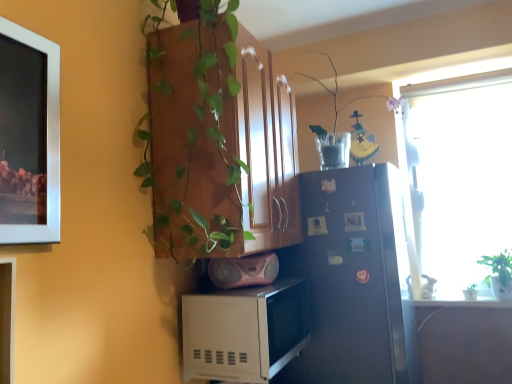
Identify the location of pink matte speaker at center. (244, 270).

Considering the relative sizes of white matte microwave at lower center and satin black refrigerator at right in the image provided, is white matte microwave at lower center smaller than satin black refrigerator at right?

Yes, white matte microwave at lower center is smaller than satin black refrigerator at right.

Would you say white matte microwave at lower center is inside or outside satin black refrigerator at right?

white matte microwave at lower center exists outside the volume of satin black refrigerator at right.

Considering the sizes of objects white matte microwave at lower center and satin black refrigerator at right in the image provided, who is wider, white matte microwave at lower center or satin black refrigerator at right?

satin black refrigerator at right.

Is the depth of white matte microwave at lower center greater than that of satin black refrigerator at right?

No.

Would you consider clear glass vase at upper right to be distant from pink matte speaker at center?

clear glass vase at upper right is far away from pink matte speaker at center.

At what (x,y) coordinates should I click in order to perform the action: click on appliance that appears below the clear glass vase at upper right (from the image's perspective). Please return your answer as a coordinate pair (x, y). Looking at the image, I should click on (244, 270).

Considering the relative sizes of clear glass vase at upper right and pink matte speaker at center in the image provided, is clear glass vase at upper right smaller than pink matte speaker at center?

Incorrect, clear glass vase at upper right is not smaller in size than pink matte speaker at center.

From the image's perspective, is clear glass vase at upper right located above pink matte speaker at center?

Yes.

Can you confirm if clear glass vase at upper right is shorter than satin black refrigerator at right?

Yes, clear glass vase at upper right is shorter than satin black refrigerator at right.

From the image's perspective, is clear glass vase at upper right on satin black refrigerator at right?

Indeed, from the image's perspective, clear glass vase at upper right is shown above satin black refrigerator at right.

Based on the photo, from a real-world perspective, is clear glass vase at upper right above or below satin black refrigerator at right?

clear glass vase at upper right is situated higher than satin black refrigerator at right in the real world.

Is pink matte speaker at center at the back of satin black refrigerator at right?

satin black refrigerator at right is not turned away from pink matte speaker at center.

In order to click on appliance above the satin black refrigerator at right (from a real-world perspective) in this screenshot , I will do tap(244, 270).

Which point is more forward, (396, 173) or (229, 278)?

Positioned in front is point (229, 278).

From the image's perspective, which one is positioned lower, satin black refrigerator at right or pink matte speaker at center?

satin black refrigerator at right.

From the picture: Which is closer to the camera, (243, 366) or (261, 276)?

Point (243, 366) is closer to the camera than point (261, 276).

Is white matte microwave at lower center oriented away from pink matte speaker at center?

That's not correct — white matte microwave at lower center is not looking away from pink matte speaker at center.

Is white matte microwave at lower center not inside pink matte speaker at center?

Yes, white matte microwave at lower center is outside of pink matte speaker at center.

Based on the photo, is white matte microwave at lower center far away from pink matte speaker at center?

white matte microwave at lower center is actually quite close to pink matte speaker at center.

Can you tell me how much satin black refrigerator at right and wooden cabinet at upper center differ in facing direction?

0.92 degrees.

In terms of size, does satin black refrigerator at right appear bigger or smaller than wooden cabinet at upper center?

satin black refrigerator at right is bigger than wooden cabinet at upper center.

From the image's perspective, is satin black refrigerator at right above or below wooden cabinet at upper center?

satin black refrigerator at right is below wooden cabinet at upper center.

Could you tell me if satin black refrigerator at right is turned towards wooden cabinet at upper center?

No.

From a real-world perspective, which is physically above, green leafy plant at right or clear glass vase at upper right?

clear glass vase at upper right, from a real-world perspective.

Considering the relative sizes of green leafy plant at right and clear glass vase at upper right in the image provided, is green leafy plant at right shorter than clear glass vase at upper right?

Yes.

Does green leafy plant at right have a greater width compared to clear glass vase at upper right?

Incorrect, the width of green leafy plant at right does not surpass that of clear glass vase at upper right.

This screenshot has width=512, height=384. I want to click on plant above the green leafy plant at right (from the image's perspective), so click(x=348, y=116).

I want to click on microwave oven on the left of satin black refrigerator at right, so click(244, 331).

Find the location of a particular element. Image resolution: width=512 pixels, height=384 pixels. plant behind the pink matte speaker at center is located at coordinates (348, 116).

Estimate the real-world distances between objects in this image. Which object is further from clear glass vase at upper right, wooden cabinet at upper center or white matte microwave at lower center?

white matte microwave at lower center is further to clear glass vase at upper right.

From the image, which object appears to be farther from green leafy plant at right, clear glass vase at upper right or white matte microwave at lower center?

Based on the image, white matte microwave at lower center appears to be further to green leafy plant at right.

When comparing their distances from pink matte speaker at center, does satin black refrigerator at right or wooden cabinet at upper center seem closer?

wooden cabinet at upper center lies closer to pink matte speaker at center than the other object.

Estimate the real-world distances between objects in this image. Which object is further from satin black refrigerator at right, wooden cabinet at upper center or green leafy plant at right?

green leafy plant at right.

Considering their positions, is green leafy plant at right positioned closer to satin black refrigerator at right than pink matte speaker at center?

pink matte speaker at center is closer to satin black refrigerator at right.

Which object lies nearer to the anchor point green leafy plant at right, clear glass vase at upper right or wooden cabinet at upper center?

clear glass vase at upper right.

Which object lies nearer to the anchor point wooden cabinet at upper center, satin black refrigerator at right or green leafy plant at right?

satin black refrigerator at right lies closer to wooden cabinet at upper center than the other object.

From the image, which object appears to be farther from green leafy plant at right, white matte microwave at lower center or pink matte speaker at center?

Among the two, white matte microwave at lower center is located further to green leafy plant at right.

Locate an element on the screen. This screenshot has height=384, width=512. microwave oven between wooden cabinet at upper center and satin black refrigerator at right vertically is located at coordinates (244, 331).

At what (x,y) coordinates should I click in order to perform the action: click on appliance between clear glass vase at upper right and white matte microwave at lower center vertically. Please return your answer as a coordinate pair (x, y). The image size is (512, 384). Looking at the image, I should click on (244, 270).

At what (x,y) coordinates should I click in order to perform the action: click on plant situated between wooden cabinet at upper center and green leafy plant at right from left to right. Please return your answer as a coordinate pair (x, y). The width and height of the screenshot is (512, 384). Looking at the image, I should click on (348, 116).

Locate an element on the screen. The image size is (512, 384). houseplant between clear glass vase at upper right and satin black refrigerator at right from top to bottom is located at coordinates pyautogui.click(x=499, y=274).